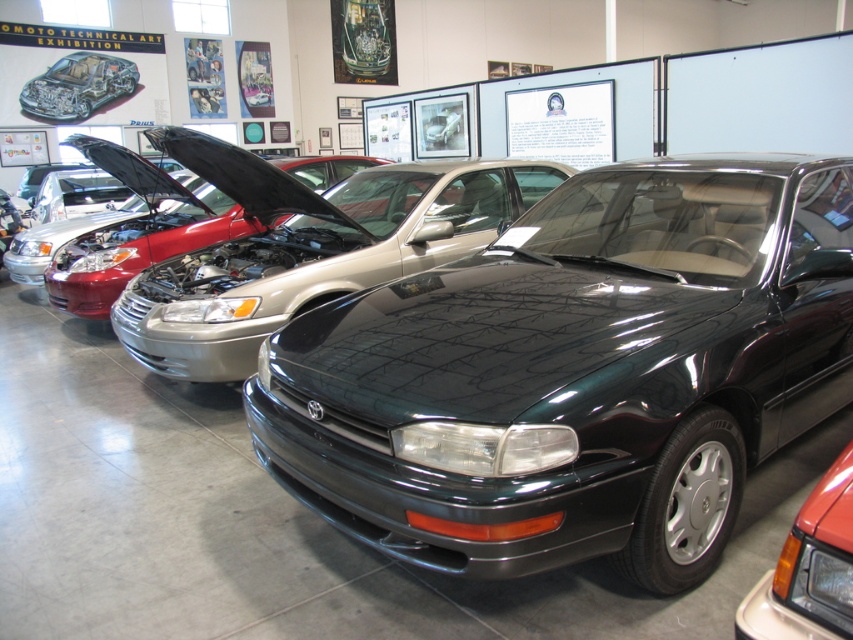
Which is below, glossy dark green car at center or matte black car at center?

glossy dark green car at center is below.

Can you confirm if glossy dark green car at center is shorter than matte black car at center?

In fact, glossy dark green car at center may be taller than matte black car at center.

Does point (463, 380) come farther from viewer compared to point (55, 120)?

No.

Locate an element on the screen. glossy dark green car at center is located at coordinates (576, 372).